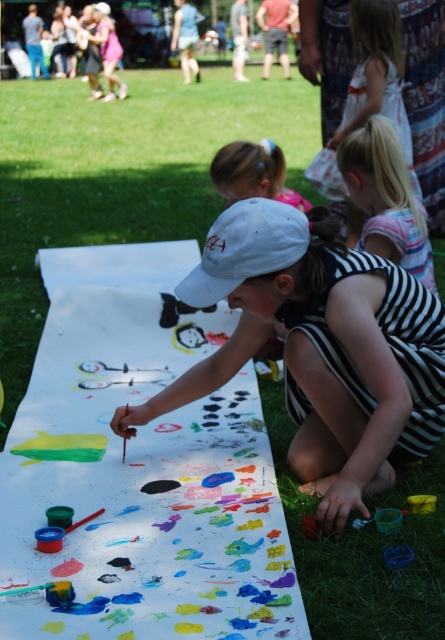
Question: Estimate the real-world distances between objects in this image. Which object is closer to the white matte cap at center?

Choices:
 (A) green grass at lower center
 (B) striped fabric dress at center

Answer: (B)

Question: Can you confirm if green grass at lower center is wider than striped fabric dress at center?

Choices:
 (A) yes
 (B) no

Answer: (A)

Question: Is green grass at lower center positioned at the back of pastel hairband at center?

Choices:
 (A) yes
 (B) no

Answer: (B)

Question: Does white matte baseball cap at center have a lesser width compared to pastel hairband at center?

Choices:
 (A) yes
 (B) no

Answer: (A)

Question: Among these points, which one is nearest to the camera?

Choices:
 (A) [245, 236]
 (B) [377, 308]
 (C) [364, 74]
 (D) [85, 136]

Answer: (A)

Question: Which point appears farthest from the camera in this image?

Choices:
 (A) (371, 224)
 (B) (360, 13)

Answer: (B)